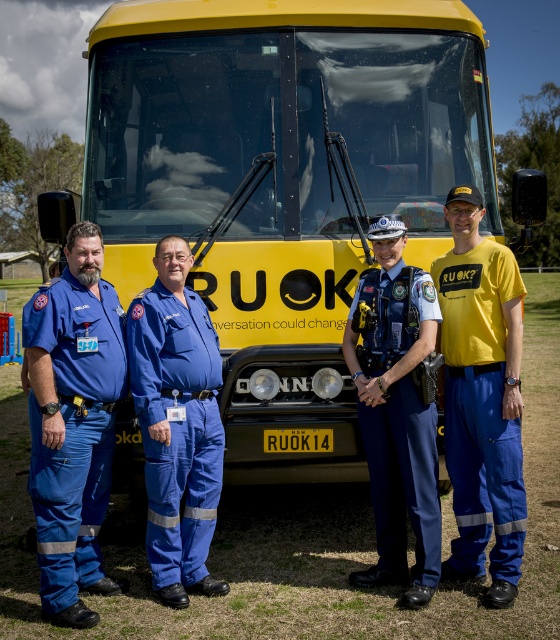
Question: Is blue fabric jumpsuit at center smaller than blue uniform at center?

Choices:
 (A) yes
 (B) no

Answer: (A)

Question: Based on their relative distances, which object is nearer to the blue cotton pants at left?

Choices:
 (A) blue fabric jumpsuit at center
 (B) yellow fabric shirt at center

Answer: (A)

Question: Does blue cotton pants at left appear under yellow fabric shirt at center?

Choices:
 (A) yes
 (B) no

Answer: (A)

Question: Among these objects, which one is nearest to the camera?

Choices:
 (A) blue fabric jumpsuit at center
 (B) blue uniform at center

Answer: (B)

Question: Which object is the farthest from the blue cotton pants at left?

Choices:
 (A) yellow matte bus at center
 (B) blue uniform at center
 (C) blue fabric jumpsuit at center
 (D) yellow fabric shirt at center

Answer: (D)

Question: Does blue cotton pants at left appear on the left side of blue fabric jumpsuit at center?

Choices:
 (A) yes
 (B) no

Answer: (A)